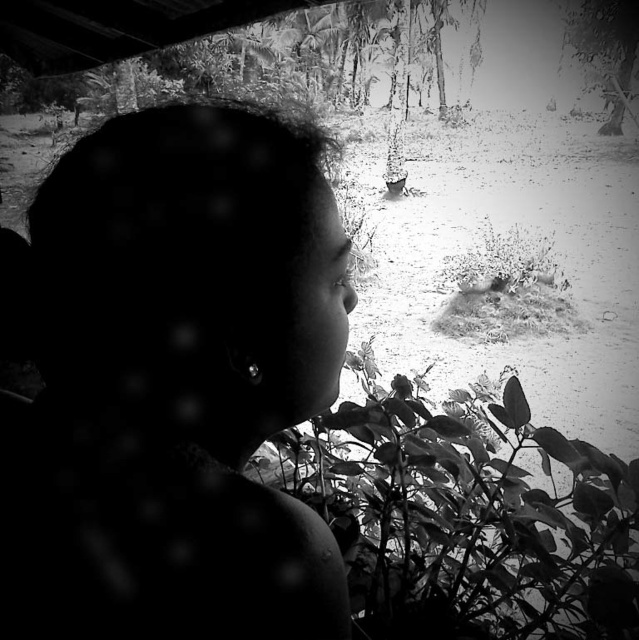
Is dark hair at left to the right of leathery green leaves at center from the viewer's perspective?

No, dark hair at left is not to the right of leathery green leaves at center.

Does dark hair at left have a smaller size compared to leathery green leaves at center?

Correct, dark hair at left occupies less space than leathery green leaves at center.

Is point (58, 586) farther from camera compared to point (520, 579)?

No.

Locate an element on the screen. The width and height of the screenshot is (639, 640). dark hair at left is located at coordinates (174, 385).